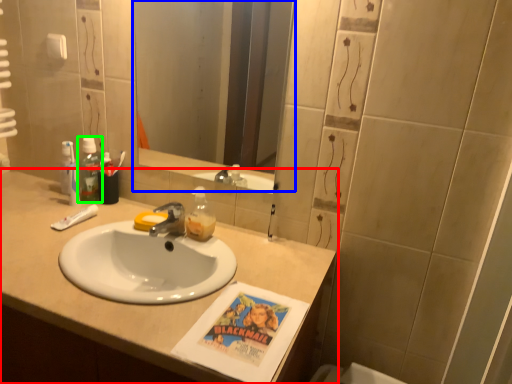
Question: Based on their relative distances, which object is farther from bathroom cabinet (highlighted by a red box)? Choose from mirror (highlighted by a blue box) and mouthwash (highlighted by a green box).

Choices:
 (A) mirror
 (B) mouthwash

Answer: (A)